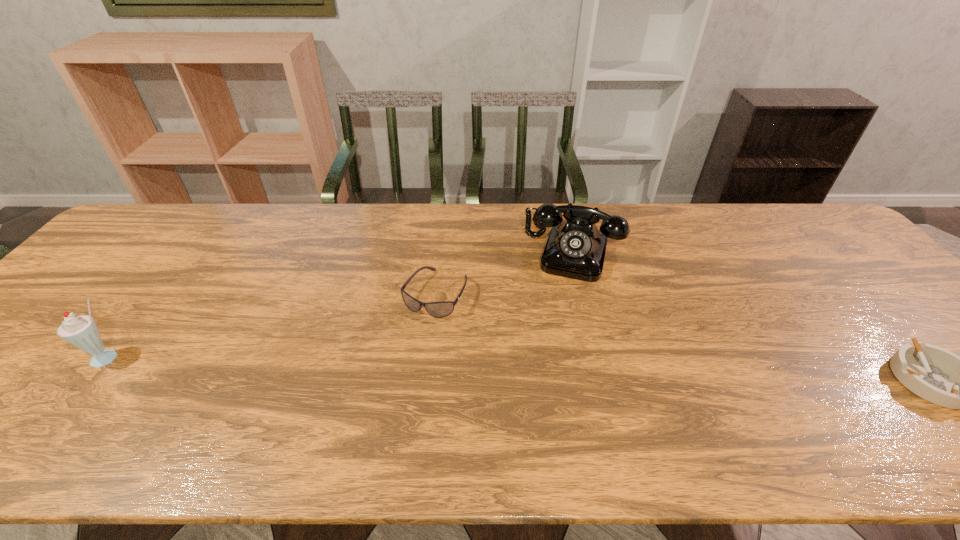
This screenshot has height=540, width=960. What are the coordinates of `milkshake` in the screenshot? It's located at (81, 331).

Where is `the leftmost object`? The height and width of the screenshot is (540, 960). the leftmost object is located at coordinates (81, 331).

At what (x,y) coordinates should I click in order to perform the action: click on telephone. Please return your answer as a coordinate pair (x, y). This screenshot has height=540, width=960. Looking at the image, I should click on (575, 248).

At what (x,y) coordinates should I click in order to perform the action: click on the third shortest object. Please return your answer as a coordinate pair (x, y). The height and width of the screenshot is (540, 960). Looking at the image, I should click on (575, 248).

What are the coordinates of `the third object from right to left` in the screenshot? It's located at (442, 309).

What are the coordinates of `the second shortest object` in the screenshot? It's located at (442, 309).

What are the coordinates of `free space located on the straw side of the leftmost object` in the screenshot? It's located at coord(85,389).

At what (x,y) coordinates should I click in order to perform the action: click on vacant space located on the dial of the telephone. Please return your answer as a coordinate pair (x, y). Looking at the image, I should click on (541, 376).

This screenshot has width=960, height=540. I want to click on vacant area situated 0.240m on the dial of the telephone, so click(549, 346).

In order to click on vacant space situated 0.120m on the dial of the telephone in this screenshot , I will do `click(558, 311)`.